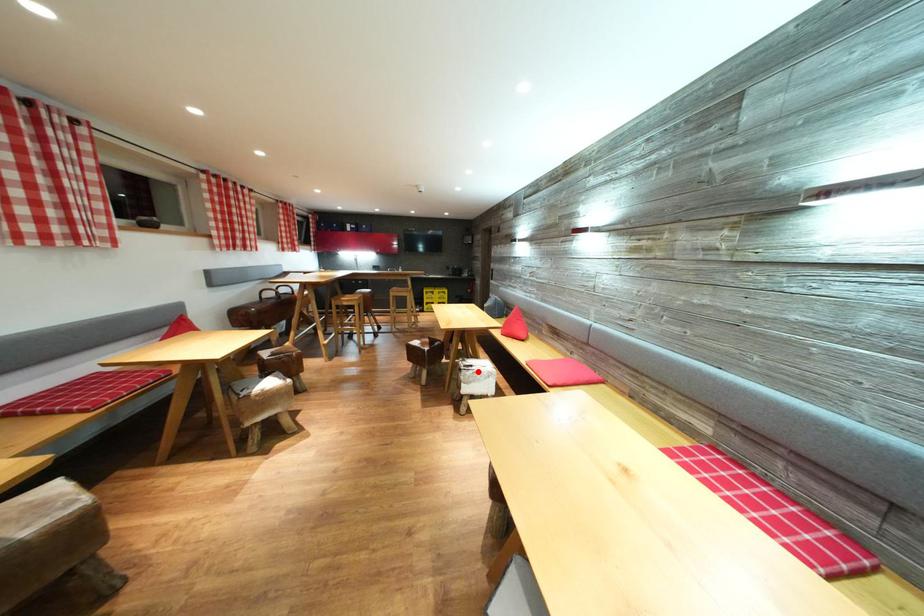
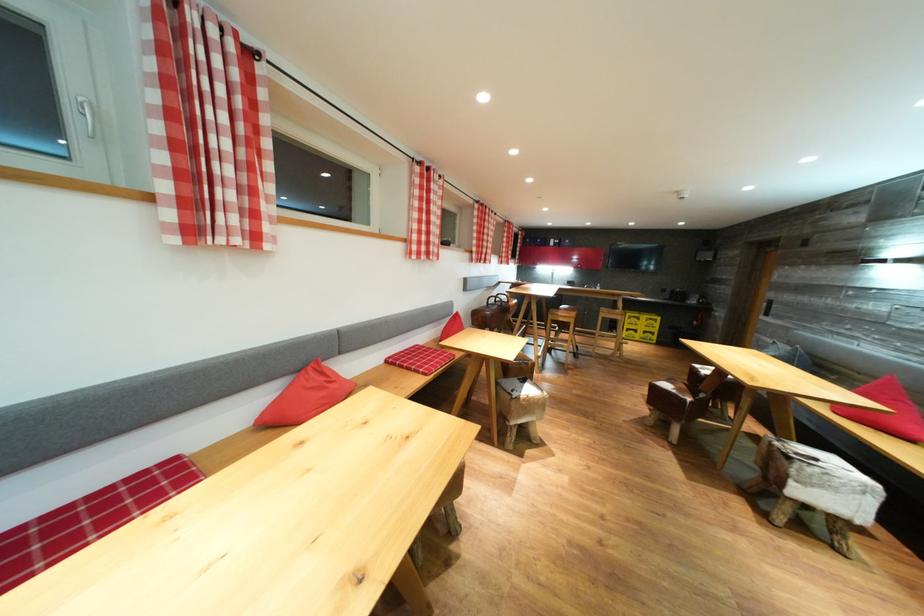
Question: I am providing you with two images of the same scene from different viewpoints. Image1 has a red point marked. In image2, the corresponding 3D location appears at what relative position? Reply with the corresponding letter.

Choices:
 (A) Closer
 (B) Farther

Answer: (B)